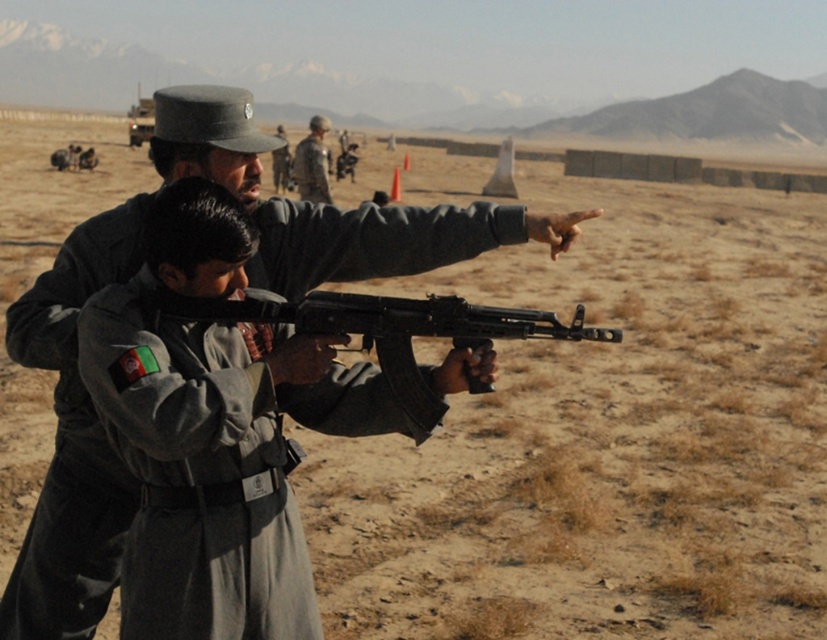
Who is lower down, matte black rifle at center or camouflage fabric uniform at center?

matte black rifle at center is lower down.

Between matte black rifle at center and camouflage fabric uniform at center, which one has more height?

Standing taller between the two is camouflage fabric uniform at center.

Describe the element at coordinates (385, 330) in the screenshot. I see `matte black rifle at center` at that location.

Where is `matte black rifle at center`? matte black rifle at center is located at coordinates (385, 330).